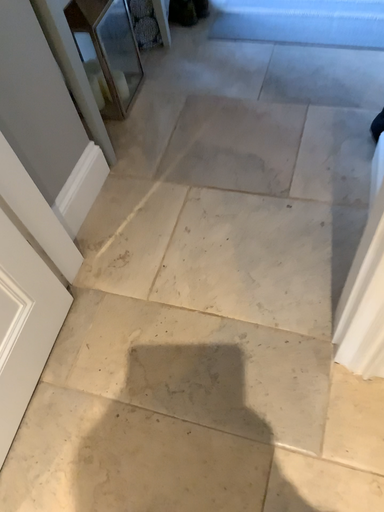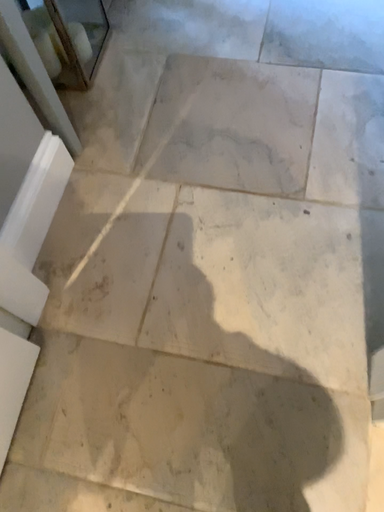
Question: Which way did the camera rotate in the video?

Choices:
 (A) rotated upward
 (B) rotated downward

Answer: (B)